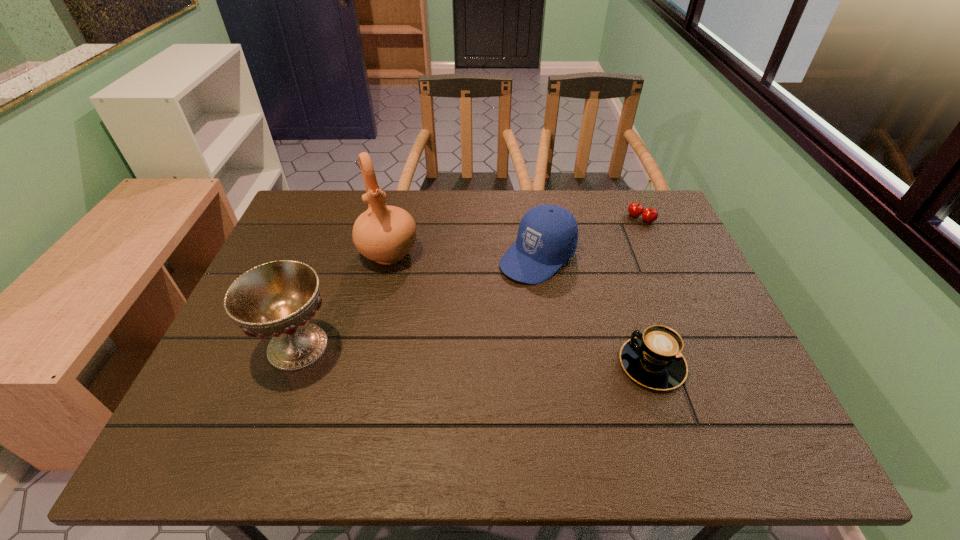
At what (x,y) coordinates should I click in order to perform the action: click on cap that is positioned at the far edge. Please return your answer as a coordinate pair (x, y). The height and width of the screenshot is (540, 960). Looking at the image, I should click on (547, 237).

You are a GUI agent. You are given a task and a screenshot of the screen. Output one action in this format:
    pyautogui.click(x=<x>, y=<y>)
    Task: Click on the chalice situated at the near edge
    
    Given the screenshot: What is the action you would take?
    pyautogui.click(x=276, y=299)

The height and width of the screenshot is (540, 960). In order to click on cappuccino that is at the near edge in this screenshot , I will do `click(653, 358)`.

This screenshot has height=540, width=960. Identify the location of object present at the left edge. (276, 299).

Locate an element on the screen. This screenshot has height=540, width=960. cappuccino present at the right edge is located at coordinates (653, 358).

Image resolution: width=960 pixels, height=540 pixels. What are the coordinates of `cherry that is at the right edge` in the screenshot? It's located at (635, 209).

This screenshot has height=540, width=960. Find the location of `object that is at the near left corner`. object that is at the near left corner is located at coordinates pyautogui.click(x=276, y=299).

Where is `object at the far right corner`? The width and height of the screenshot is (960, 540). object at the far right corner is located at coordinates (635, 209).

I want to click on object located in the near right corner section of the desktop, so click(x=653, y=358).

The height and width of the screenshot is (540, 960). Find the location of `blank space at the far edge of the desktop`. blank space at the far edge of the desktop is located at coordinates (449, 218).